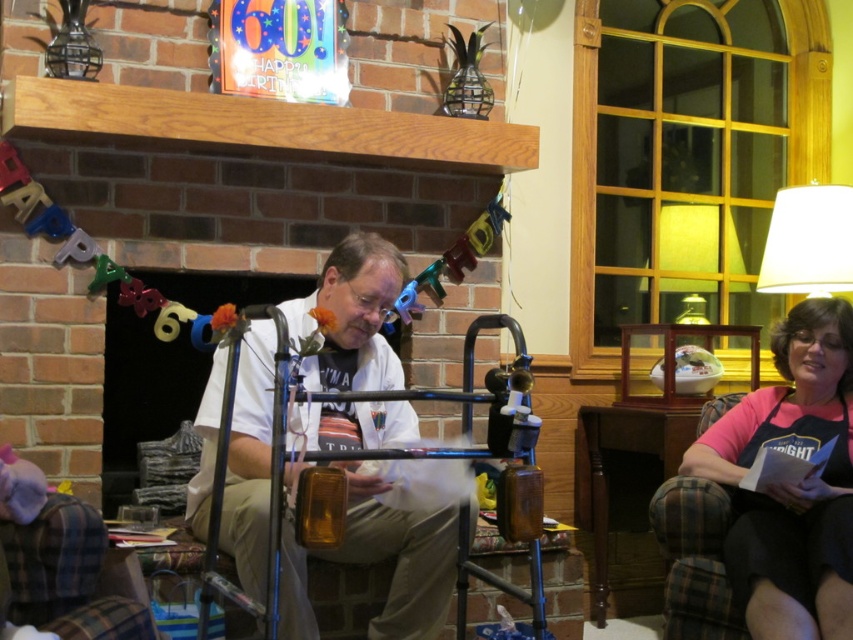
Does pink fabric apron at lower right have a lesser height compared to white fabric lampshade at upper right?

In fact, pink fabric apron at lower right may be taller than white fabric lampshade at upper right.

Between pink fabric apron at lower right and white fabric lampshade at upper right, which one has less height?

white fabric lampshade at upper right

The image size is (853, 640). What do you see at coordinates (790, 484) in the screenshot?
I see `pink fabric apron at lower right` at bounding box center [790, 484].

Where is `pink fabric apron at lower right`? The image size is (853, 640). pink fabric apron at lower right is located at coordinates (790, 484).

Does white matte walker at center appear on the right side of white fabric lampshade at upper right?

Incorrect, white matte walker at center is not on the right side of white fabric lampshade at upper right.

Can you confirm if white matte walker at center is positioned above white fabric lampshade at upper right?

No.

Is point (351, 298) positioned in front of point (786, 232)?

That is True.

The image size is (853, 640). Identify the location of white matte walker at center. (352, 316).

Is white fabric lampshade at upper right to the left of matte glass lampshade at upper right from the viewer's perspective?

In fact, white fabric lampshade at upper right is to the right of matte glass lampshade at upper right.

Between white fabric lampshade at upper right and matte glass lampshade at upper right, which one appears on the left side from the viewer's perspective?

From the viewer's perspective, matte glass lampshade at upper right appears more on the left side.

Is point (804, 193) farther from camera compared to point (640, 285)?

That is False.

What are the coordinates of `white fabric lampshade at upper right` in the screenshot? It's located at (808, 241).